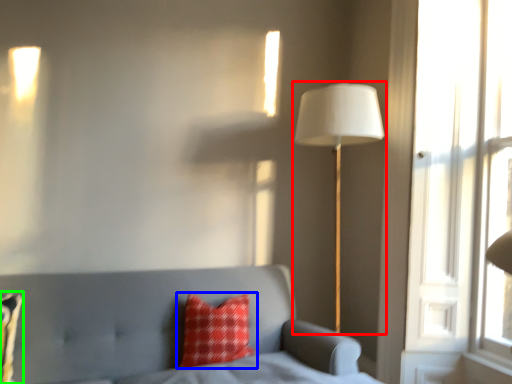
Question: Which object is the closest to the lamp (highlighted by a red box)? Choose among these: pillow (highlighted by a blue box) or pillow (highlighted by a green box).

Choices:
 (A) pillow
 (B) pillow

Answer: (A)